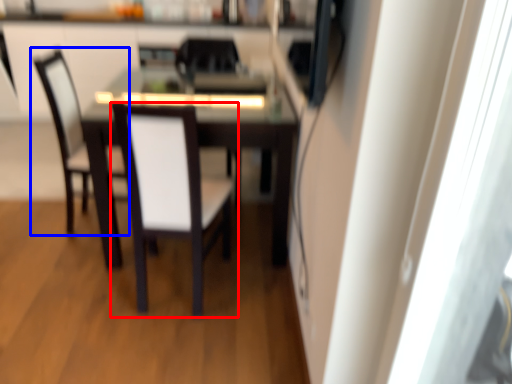
Question: Among these objects, which one is nearest to the camera, chair (highlighted by a red box) or chair (highlighted by a blue box)?

Choices:
 (A) chair
 (B) chair

Answer: (A)